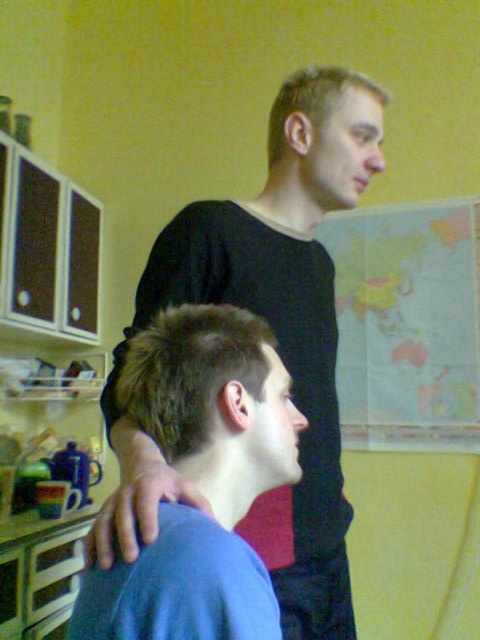
You are a tailor measuring shirts for two customers. You see the black matte shirt at upper center and the blue matte shirt at center. Which shirt has a larger width?

The black matte shirt at upper center has a larger width than the blue matte shirt at center according to the description.

In the scene shown: You are a photographer setting up a shoot in this room. You want to ensure both the black matte shirt at upper center and the blue matte shirt at center are visible in the frame. Given their current positions, which shirt should you adjust to avoid blocking the other?

The blue matte shirt at center is behind the black matte shirt at upper center. To ensure both are visible, adjust the blue matte shirt at center to move it forward so it is not obscured by the black matte shirt at upper center.